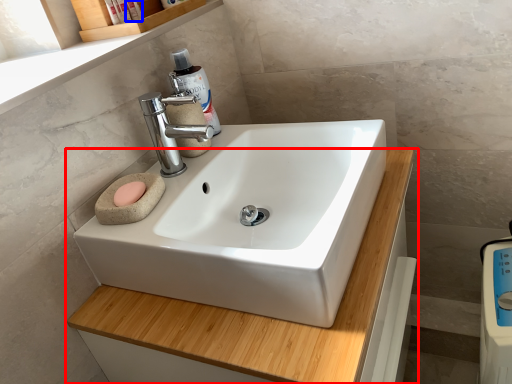
Question: Which of the following is the closest to the observer, bathroom cabinet (highlighted by a red box) or toiletry (highlighted by a blue box)?

Choices:
 (A) bathroom cabinet
 (B) toiletry

Answer: (A)